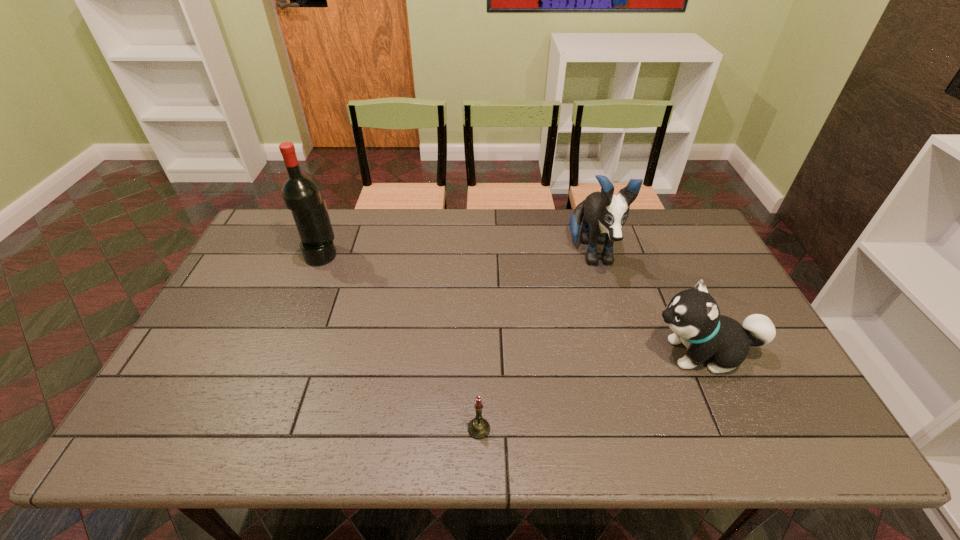
You are a GUI agent. You are given a task and a screenshot of the screen. Output one action in this format:
    pyautogui.click(x=<x>, y=<y>)
    Task: Click on the free space at the right edge of the desktop
    The width and height of the screenshot is (960, 540).
    Given the screenshot: What is the action you would take?
    pyautogui.click(x=712, y=254)

This screenshot has height=540, width=960. Identify the location of free space at the far left corner. (287, 224).

The image size is (960, 540). Find the location of `free location at the near left corner of the desktop`. free location at the near left corner of the desktop is located at coordinates (205, 430).

You are a GUI agent. You are given a task and a screenshot of the screen. Output one action in this format:
    pyautogui.click(x=<x>, y=<y>)
    Task: Click on the blank area at the far right corner
    Image resolution: width=960 pixels, height=540 pixels.
    Given the screenshot: What is the action you would take?
    pyautogui.click(x=679, y=247)

The image size is (960, 540). In the image, there is a desktop. Identify the location of free space at the near right corner. (804, 432).

Where is `vacant area that lies between the second object from right to left and the right puppy`? Image resolution: width=960 pixels, height=540 pixels. vacant area that lies between the second object from right to left and the right puppy is located at coordinates (647, 303).

I want to click on vacant space in between the farther puppy and the candle, so click(x=535, y=342).

In order to click on free space between the right puppy and the wine bottle in this screenshot , I will do `click(512, 304)`.

At what (x,y) coordinates should I click in order to perform the action: click on vacant area that lies between the rightmost object and the wine bottle. Please return your answer as a coordinate pair (x, y). Looking at the image, I should click on (512, 304).

Identify the location of vacant region between the wine bottle and the shorter puppy. The height and width of the screenshot is (540, 960). (512, 304).